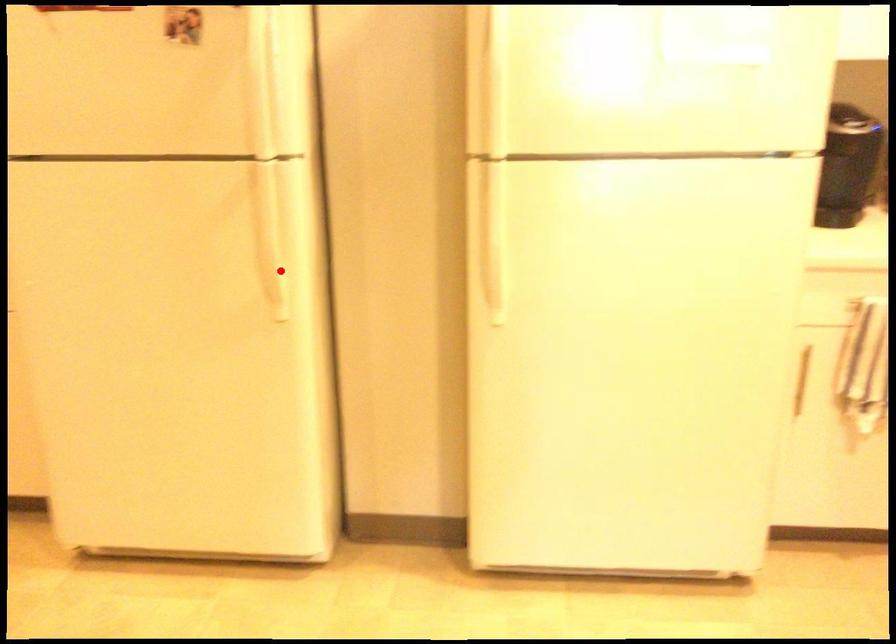
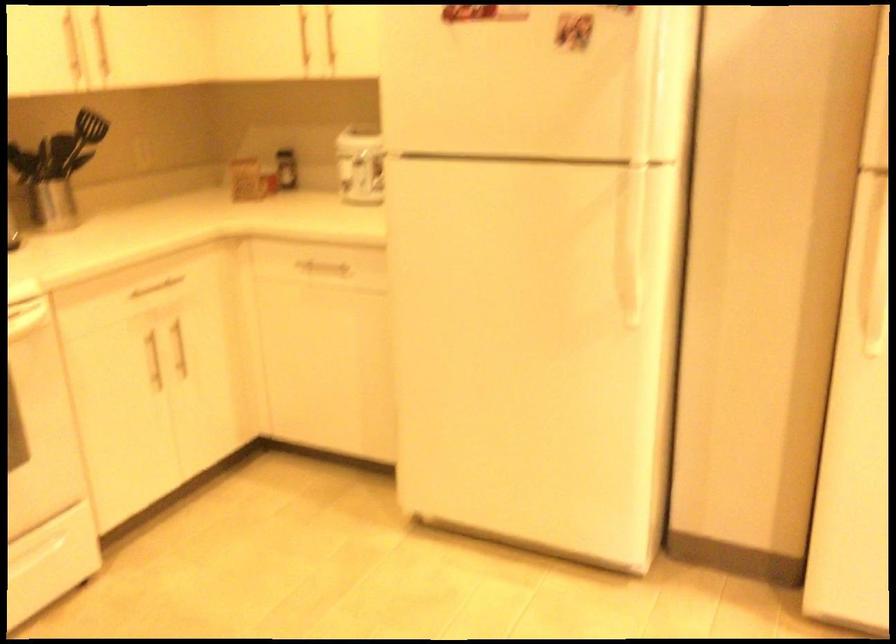
The point at the highlighted location is marked in the first image. Where is the corresponding point in the second image?

(634, 277)